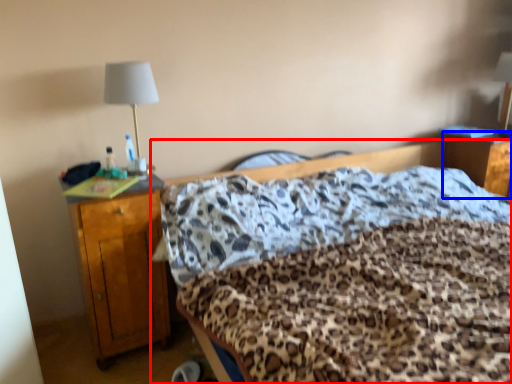
Question: Which point is closer to the camera, bed (highlighted by a red box) or nightstand (highlighted by a blue box)?

Choices:
 (A) bed
 (B) nightstand

Answer: (A)